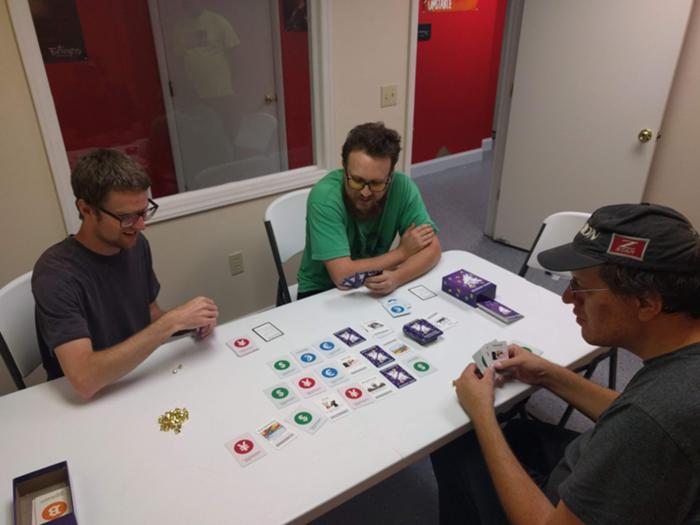
This screenshot has width=700, height=525. In order to click on playing cards in this screenshot , I will do `click(497, 350)`, `click(360, 275)`, `click(204, 327)`, `click(245, 346)`, `click(246, 450)`, `click(400, 379)`, `click(332, 370)`, `click(312, 353)`, `click(420, 329)`, `click(474, 293)`.